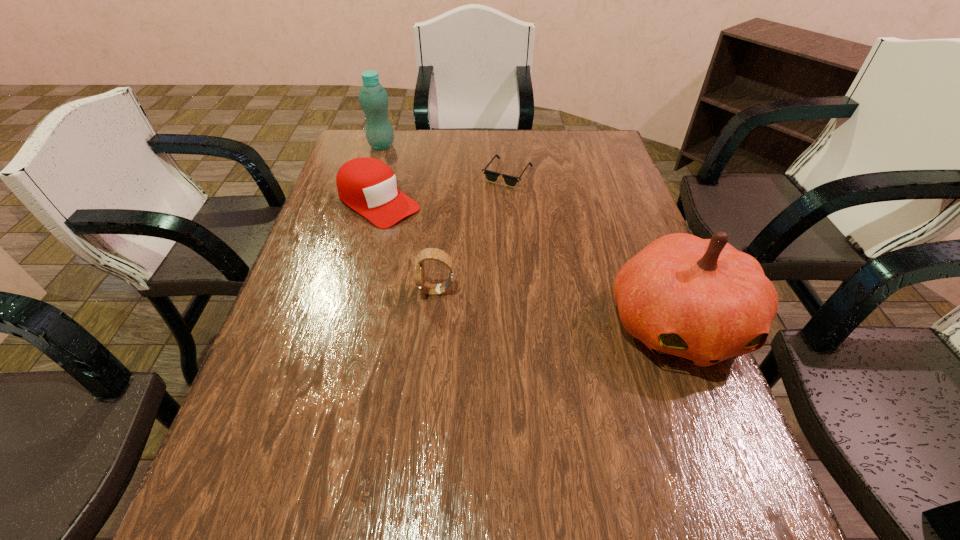
This screenshot has width=960, height=540. In order to click on vacant space that's between the watch and the pumpkin in this screenshot , I will do `click(558, 307)`.

The height and width of the screenshot is (540, 960). I want to click on object that is the second closest to the pumpkin, so click(491, 176).

Identify which object is the second closest to the baseball cap. Please provide its 2D coordinates. Your answer should be formatted as a tuple, i.e. [(x, y)], where the tuple contains the x and y coordinates of a point satisfying the conditions above.

[(491, 176)]

You are a GUI agent. You are given a task and a screenshot of the screen. Output one action in this format:
    pyautogui.click(x=<x>, y=<y>)
    Task: Click on the vacant space that satisfies the following two spatial constraints: 1. on the front side of the watch; 2. on the face of the farthest object
    The image size is (960, 540).
    Given the screenshot: What is the action you would take?
    pyautogui.click(x=338, y=291)

This screenshot has width=960, height=540. I want to click on vacant space that satisfies the following two spatial constraints: 1. on the front side of the watch; 2. on the face of the water bottle, so click(338, 291).